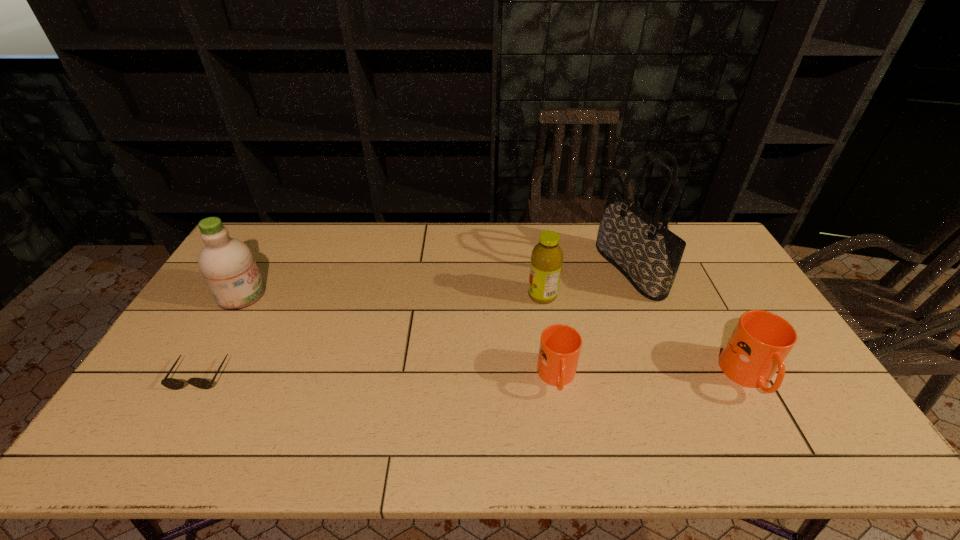
Image resolution: width=960 pixels, height=540 pixels. What are the coordinates of `free area in between the tote bag and the left mug` in the screenshot? It's located at (593, 324).

Find the location of a particular element. Image resolution: width=960 pixels, height=540 pixels. vacant space in between the fruit juice and the fourth tallest object is located at coordinates (646, 336).

Where is `free space between the shortest object and the third tallest object`? free space between the shortest object and the third tallest object is located at coordinates (372, 335).

I want to click on free point between the sunglasses and the left mug, so click(378, 376).

Image resolution: width=960 pixels, height=540 pixels. In order to click on empty space that is in between the sunglasses and the tote bag in this screenshot , I will do `click(415, 322)`.

You are a GUI agent. You are given a task and a screenshot of the screen. Output one action in this format:
    pyautogui.click(x=<x>, y=<y>)
    Task: Click on the object that is the fourth closest to the tallest object
    This screenshot has width=960, height=540.
    Given the screenshot: What is the action you would take?
    pyautogui.click(x=227, y=264)

You are a GUI agent. You are given a task and a screenshot of the screen. Output one action in this format:
    pyautogui.click(x=<x>, y=<y>)
    Task: Click on the fourth closest object to the sunglasses
    This screenshot has height=540, width=960.
    Given the screenshot: What is the action you would take?
    pyautogui.click(x=647, y=253)